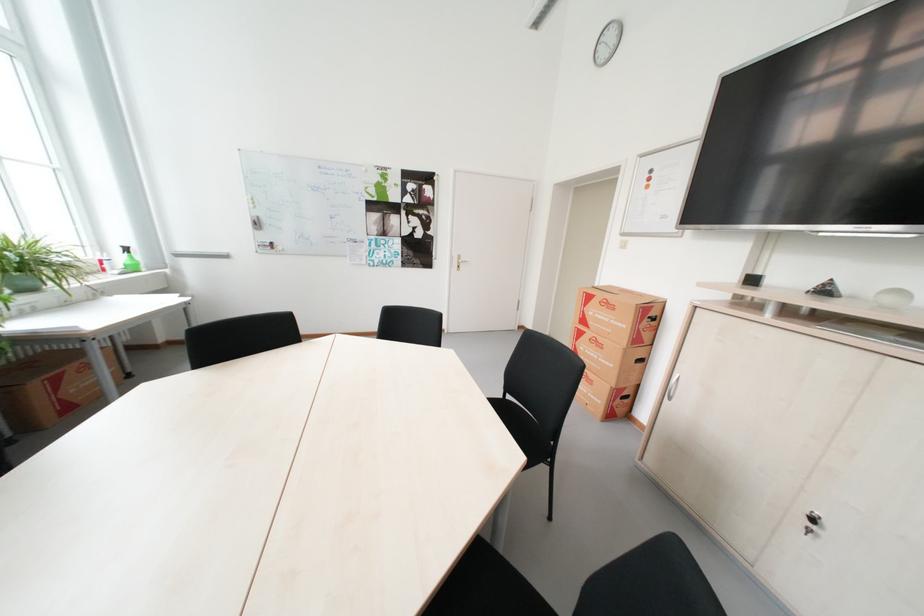
Which object does [824,289] point to?

It corresponds to the black pyramid object in the image.